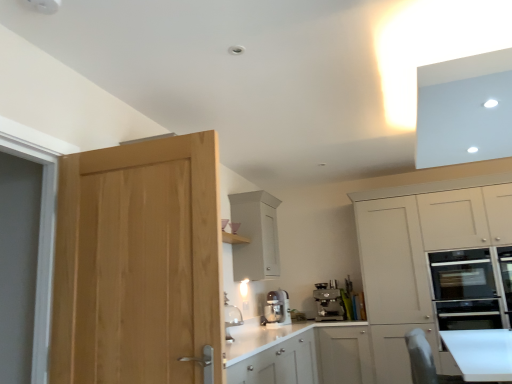
This screenshot has height=384, width=512. Describe the element at coordinates (269, 337) in the screenshot. I see `white glossy countertop at center` at that location.

How much space does satin silver coffee machine at lower center, the first kitchen appliance viewed from the right, occupy horizontally?

It is 15.33 inches.

The image size is (512, 384). I want to click on satin silver mixer at center, the second kitchen appliance viewed from the right, so click(277, 309).

Is white glossy countertop at center behind white matte cabinet at right, which is the 1th cabinetry from right to left?

Yes, white glossy countertop at center is further from the camera.

From the image's perspective, is white glossy countertop at center over white matte cabinet at right, acting as the second cabinetry starting from the left?

Incorrect, from the image's perspective, white glossy countertop at center is lower than white matte cabinet at right, acting as the second cabinetry starting from the left.

Which is more to the right, white glossy countertop at center or white matte cabinet at right, which is the 1th cabinetry from right to left?

Positioned to the right is white matte cabinet at right, which is the 1th cabinetry from right to left.

Considering the sizes of objects white matte cabinet at right, acting as the second cabinetry starting from the left, and natural wood door at left in the image provided, who is wider, white matte cabinet at right, acting as the second cabinetry starting from the left, or natural wood door at left?

white matte cabinet at right, acting as the second cabinetry starting from the left, is wider.

Is white matte cabinet at right, which is the 1th cabinetry from right to left, turned away from natural wood door at left?

That's not correct — white matte cabinet at right, which is the 1th cabinetry from right to left, is not looking away from natural wood door at left.

Which is behind, white matte cabinet at right, which is the 1th cabinetry from right to left, or natural wood door at left?

white matte cabinet at right, which is the 1th cabinetry from right to left, is more distant.

Can natural wood door at left be found inside white matte cabinet at right, which is the 1th cabinetry from right to left?

No, white matte cabinet at right, which is the 1th cabinetry from right to left, does not contain natural wood door at left.

There is a satin silver mixer at center, the second kitchen appliance viewed from the right. Where is `the 2nd cabinetry above it (from the image's perspective)`? the 2nd cabinetry above it (from the image's perspective) is located at coordinates (255, 235).

Which is more to the right, satin silver mixer at center, the 1th kitchen appliance in the left-to-right sequence, or white matte cabinet at upper center, which is counted as the second cabinetry, starting from the right?

satin silver mixer at center, the 1th kitchen appliance in the left-to-right sequence.

Is satin silver mixer at center, the 1th kitchen appliance in the left-to-right sequence, inside or outside of white matte cabinet at upper center, which ranks as the 1th cabinetry in left-to-right order?

The correct answer is: outside.

Is satin silver coffee machine at lower center, the first kitchen appliance viewed from the right, looking in the opposite direction of white glossy countertop at center?

satin silver coffee machine at lower center, the first kitchen appliance viewed from the right, does not have its back to white glossy countertop at center.

From the image's perspective, is satin silver coffee machine at lower center, the 2th kitchen appliance viewed from the left, above white glossy countertop at center?

Yes.

Considering the relative sizes of satin silver coffee machine at lower center, the 2th kitchen appliance viewed from the left, and white glossy countertop at center in the image provided, is satin silver coffee machine at lower center, the 2th kitchen appliance viewed from the left, smaller than white glossy countertop at center?

Indeed, satin silver coffee machine at lower center, the 2th kitchen appliance viewed from the left, has a smaller size compared to white glossy countertop at center.

Is point (335, 306) positioned before point (246, 355)?

No, (335, 306) is further to viewer.

How far apart are white matte cabinet at upper center, which ranks as the 1th cabinetry in left-to-right order, and white glossy countertop at center?

85.39 centimeters.

Is white matte cabinet at upper center, which is counted as the second cabinetry, starting from the right, inside or outside of white glossy countertop at center?

white matte cabinet at upper center, which is counted as the second cabinetry, starting from the right, is not inside white glossy countertop at center, it's outside.

Considering the relative sizes of white matte cabinet at upper center, which ranks as the 1th cabinetry in left-to-right order, and white glossy countertop at center in the image provided, is white matte cabinet at upper center, which ranks as the 1th cabinetry in left-to-right order, smaller than white glossy countertop at center?

Yes.

Between white matte cabinet at upper center, which is counted as the second cabinetry, starting from the right, and white glossy countertop at center, which one has larger width?

With larger width is white glossy countertop at center.

Between white glossy countertop at center and white matte cabinet at upper center, which ranks as the 1th cabinetry in left-to-right order, which one is positioned behind?

Positioned behind is white glossy countertop at center.

How many degrees apart are the facing directions of white glossy countertop at center and white matte cabinet at upper center, which is counted as the second cabinetry, starting from the right?

They differ by 89.8 degrees in their facing directions.

Does white glossy countertop at center have a lesser width compared to white matte cabinet at upper center, which ranks as the 1th cabinetry in left-to-right order?

In fact, white glossy countertop at center might be wider than white matte cabinet at upper center, which ranks as the 1th cabinetry in left-to-right order.

In the scene shown: Is white matte cabinet at right, which is the 1th cabinetry from right to left, facing away from satin silver coffee machine at lower center, the 2th kitchen appliance viewed from the left?

That's not correct — white matte cabinet at right, which is the 1th cabinetry from right to left, is not looking away from satin silver coffee machine at lower center, the 2th kitchen appliance viewed from the left.

Does point (400, 318) lie in front of point (327, 319)?

Yes.

Does white matte cabinet at right, which is the 1th cabinetry from right to left, contain satin silver coffee machine at lower center, the first kitchen appliance viewed from the right?

No, satin silver coffee machine at lower center, the first kitchen appliance viewed from the right, is not inside white matte cabinet at right, which is the 1th cabinetry from right to left.

At what (x,y) coordinates should I click in order to perform the action: click on countertop on the left side of white matte cabinet at right, acting as the second cabinetry starting from the left. Please return your answer as a coordinate pair (x, y). This screenshot has width=512, height=384. Looking at the image, I should click on (269, 337).

Where is `door above the white matte cabinet at right, acting as the second cabinetry starting from the left (from the image's perspective)`? door above the white matte cabinet at right, acting as the second cabinetry starting from the left (from the image's perspective) is located at coordinates (137, 263).

When comparing their distances from white matte cabinet at right, which is the 1th cabinetry from right to left, does white glossy countertop at center or satin silver mixer at center, the second kitchen appliance viewed from the right, seem further?

The object further to white matte cabinet at right, which is the 1th cabinetry from right to left, is satin silver mixer at center, the second kitchen appliance viewed from the right.

From the image, which object appears to be nearer to natural wood door at left, satin silver coffee machine at lower center, the first kitchen appliance viewed from the right, or white glossy countertop at center?

white glossy countertop at center is positioned closer to the anchor natural wood door at left.

Considering their positions, is white matte cabinet at right, acting as the second cabinetry starting from the left, positioned closer to white matte cabinet at upper center, which ranks as the 1th cabinetry in left-to-right order, than satin silver coffee machine at lower center, the first kitchen appliance viewed from the right?

The object closer to white matte cabinet at upper center, which ranks as the 1th cabinetry in left-to-right order, is satin silver coffee machine at lower center, the first kitchen appliance viewed from the right.

Which object lies further to the anchor point satin silver coffee machine at lower center, the first kitchen appliance viewed from the right, white matte cabinet at right, which is the 1th cabinetry from right to left, or natural wood door at left?

Among the two, natural wood door at left is located further to satin silver coffee machine at lower center, the first kitchen appliance viewed from the right.

When comparing their distances from white glossy countertop at center, does satin silver coffee machine at lower center, the 2th kitchen appliance viewed from the left, or white matte cabinet at right, which is the 1th cabinetry from right to left, seem closer?

satin silver coffee machine at lower center, the 2th kitchen appliance viewed from the left, lies closer to white glossy countertop at center than the other object.

Looking at the image, which one is located further to white matte cabinet at upper center, which ranks as the 1th cabinetry in left-to-right order, satin silver coffee machine at lower center, the 2th kitchen appliance viewed from the left, or satin silver mixer at center, the second kitchen appliance viewed from the right?

satin silver coffee machine at lower center, the 2th kitchen appliance viewed from the left, is further to white matte cabinet at upper center, which ranks as the 1th cabinetry in left-to-right order.

Looking at the image, which one is located further to white matte cabinet at upper center, which ranks as the 1th cabinetry in left-to-right order, white matte cabinet at right, acting as the second cabinetry starting from the left, or natural wood door at left?

Based on the image, natural wood door at left appears to be further to white matte cabinet at upper center, which ranks as the 1th cabinetry in left-to-right order.

When comparing their distances from white glossy countertop at center, does white matte cabinet at upper center, which ranks as the 1th cabinetry in left-to-right order, or satin silver coffee machine at lower center, the first kitchen appliance viewed from the right, seem closer?

satin silver coffee machine at lower center, the first kitchen appliance viewed from the right.

Where is `cabinetry between natural wood door at left and white matte cabinet at right, which is the 1th cabinetry from right to left, from left to right`? This screenshot has height=384, width=512. cabinetry between natural wood door at left and white matte cabinet at right, which is the 1th cabinetry from right to left, from left to right is located at coordinates (255, 235).

Locate an element on the screen. countertop located between natural wood door at left and satin silver mixer at center, the second kitchen appliance viewed from the right, in the depth direction is located at coordinates (269, 337).

This screenshot has height=384, width=512. Find the location of `countertop located between satin silver mixer at center, the 1th kitchen appliance in the left-to-right sequence, and white matte cabinet at right, acting as the second cabinetry starting from the left, in the left-right direction`. countertop located between satin silver mixer at center, the 1th kitchen appliance in the left-to-right sequence, and white matte cabinet at right, acting as the second cabinetry starting from the left, in the left-right direction is located at coordinates (x=269, y=337).

Locate an element on the screen. kitchen appliance between natural wood door at left and satin silver coffee machine at lower center, the first kitchen appliance viewed from the right, in the front-back direction is located at coordinates click(277, 309).